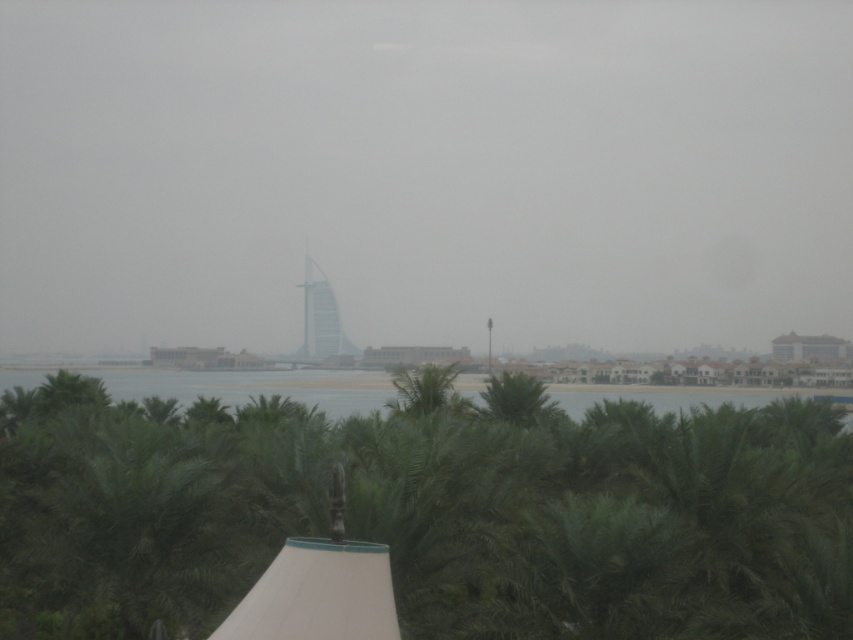
You are a tourist standing at the coastal area and want to take a photo of both the transparent glass skyscraper at center and the glassy white sail at center. Which one will appear larger in your photo?

The transparent glass skyscraper at center will appear larger in the photo because it is bigger than the glassy white sail at center.

You are a photographer planning to capture the Burj Al Arab hotel in Dubai. You notice the green leafy water at center and the glassy white sail at center in your viewfinder. Which object should you adjust your camera angle to avoid covering the Burj Al Arab?

The green leafy water at center is positioned under the glassy white sail at center, so adjusting the camera angle to avoid the green leafy water at center would ensure the Burj Al Arab remains visible.

You are a city planner analyzing the coastal view. You notice the transparent glass skyscraper at center and the green leafy tree at center. Which object appears to occupy more horizontal space in the scene?

The transparent glass skyscraper at center might be wider than green leafy tree at center, so it likely occupies more horizontal space in the scene.